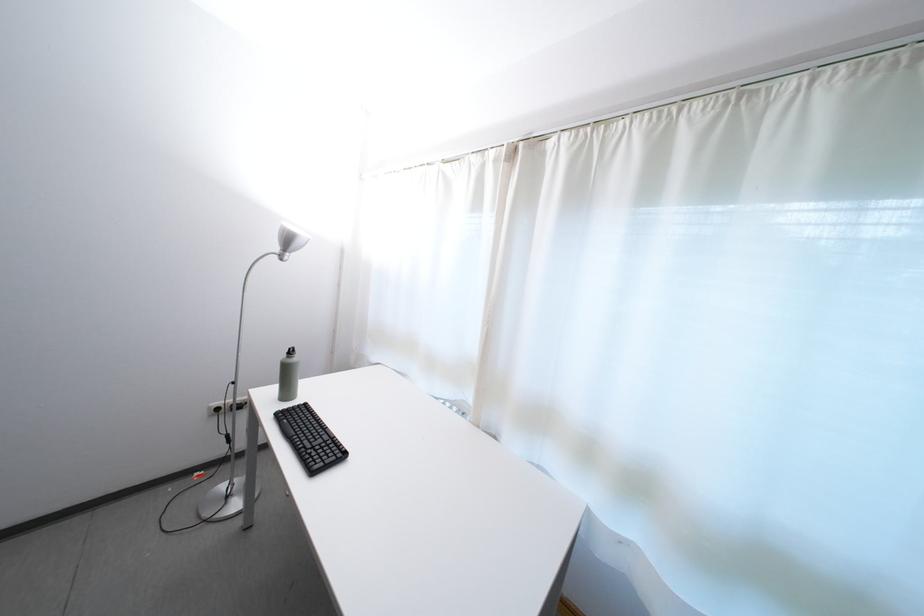
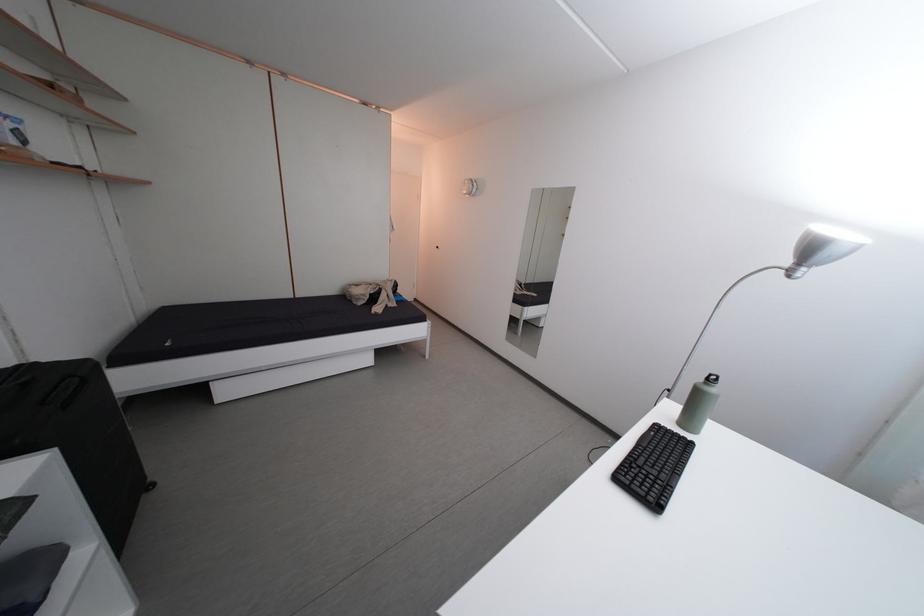
In the second image, find the point that corresponds to (294,361) in the first image.

(712, 386)